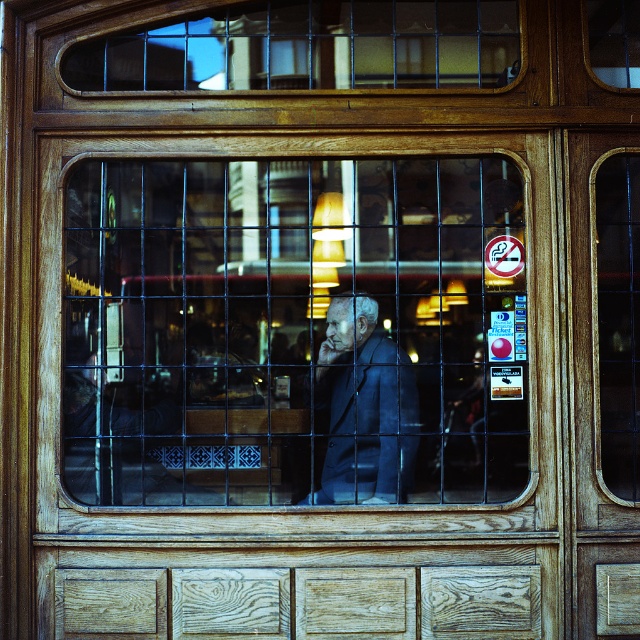
Which of these two, matte glass window at center or dark blue suit at center, stands taller?

Standing taller between the two is matte glass window at center.

Is point (387, 256) closer to camera compared to point (326, 397)?

No, it is not.

Identify the location of matte glass window at center. (294, 332).

At what (x,y) coordinates should I click in order to perform the action: click on matte glass window at center. Please return your answer as a coordinate pair (x, y). The image size is (640, 640). Looking at the image, I should click on (294, 332).